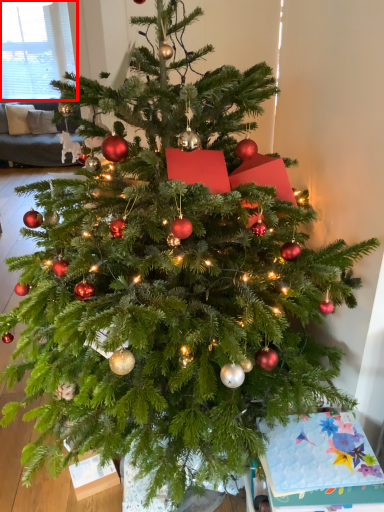
Question: From the image, what is the correct spatial relationship of window screen (annotated by the red box) in relation to christmas card?

Choices:
 (A) right
 (B) left

Answer: (B)